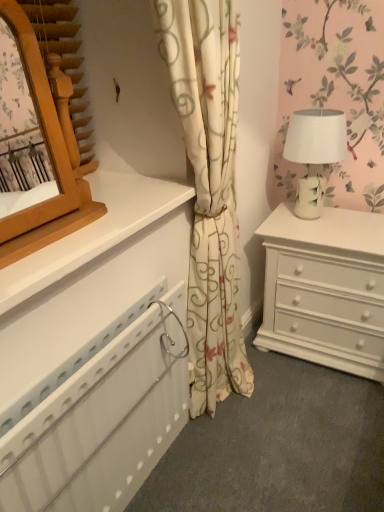
You are a GUI agent. You are given a task and a screenshot of the screen. Output one action in this format:
    pyautogui.click(x=<x>, y=<y>)
    Task: Click on the free point in front of white ceramic table lamp at right
    The width and height of the screenshot is (384, 512).
    Given the screenshot: What is the action you would take?
    (334, 233)